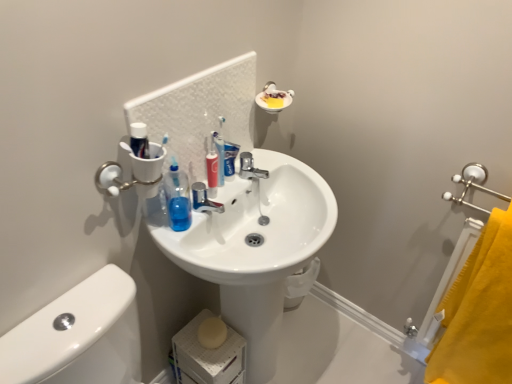
Question: From the image's perspective, is white glossy toothpaste at center below yellow fabric towel at right?

Choices:
 (A) yes
 (B) no

Answer: (B)

Question: Considering the relative sizes of white glossy toothpaste at center and yellow fabric towel at right in the image provided, is white glossy toothpaste at center bigger than yellow fabric towel at right?

Choices:
 (A) yes
 (B) no

Answer: (B)

Question: Does white glossy toothpaste at center appear on the right side of yellow fabric towel at right?

Choices:
 (A) yes
 (B) no

Answer: (B)

Question: Considering the relative sizes of white glossy toothpaste at center and yellow fabric towel at right in the image provided, is white glossy toothpaste at center thinner than yellow fabric towel at right?

Choices:
 (A) no
 (B) yes

Answer: (B)

Question: Can you confirm if white glossy toothpaste at center is positioned to the left of yellow fabric towel at right?

Choices:
 (A) yes
 (B) no

Answer: (A)

Question: Would you say white glossy toothpaste at center contains yellow fabric towel at right?

Choices:
 (A) yes
 (B) no

Answer: (B)

Question: Does white glossy toothpaste at center touch translucent plastic toothbrush at center?

Choices:
 (A) no
 (B) yes

Answer: (B)

Question: Is white glossy toothpaste at center oriented towards translucent plastic toothbrush at center?

Choices:
 (A) no
 (B) yes

Answer: (A)

Question: Does white glossy toothpaste at center have a greater width compared to translucent plastic toothbrush at center?

Choices:
 (A) yes
 (B) no

Answer: (B)

Question: Would you consider white glossy toothpaste at center to be distant from translucent plastic toothbrush at center?

Choices:
 (A) yes
 (B) no

Answer: (B)

Question: Is white glossy toothpaste at center facing away from translucent plastic toothbrush at center?

Choices:
 (A) no
 (B) yes

Answer: (A)

Question: Is white glossy toothpaste at center taller than translucent plastic toothbrush at center?

Choices:
 (A) no
 (B) yes

Answer: (A)

Question: Is white glossy sink at center facing away from translucent plastic toothbrush at center?

Choices:
 (A) no
 (B) yes

Answer: (A)